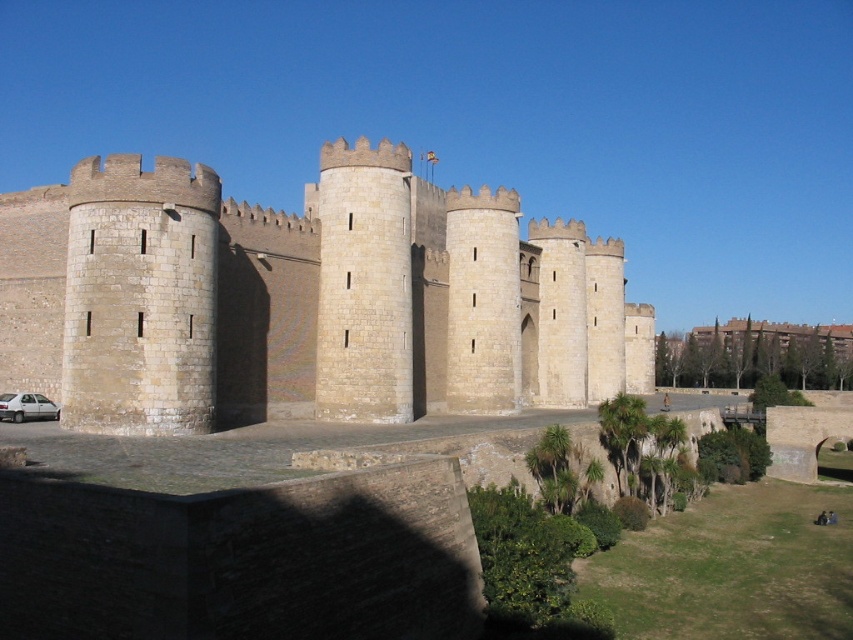
Which of these two, beige stone castle at center or silver metallic car at lower left, stands shorter?

silver metallic car at lower left is shorter.

Is beige stone castle at center below silver metallic car at lower left?

No.

The image size is (853, 640). Describe the element at coordinates (305, 300) in the screenshot. I see `beige stone castle at center` at that location.

Locate an element on the screen. The image size is (853, 640). beige stone castle at center is located at coordinates (305, 300).